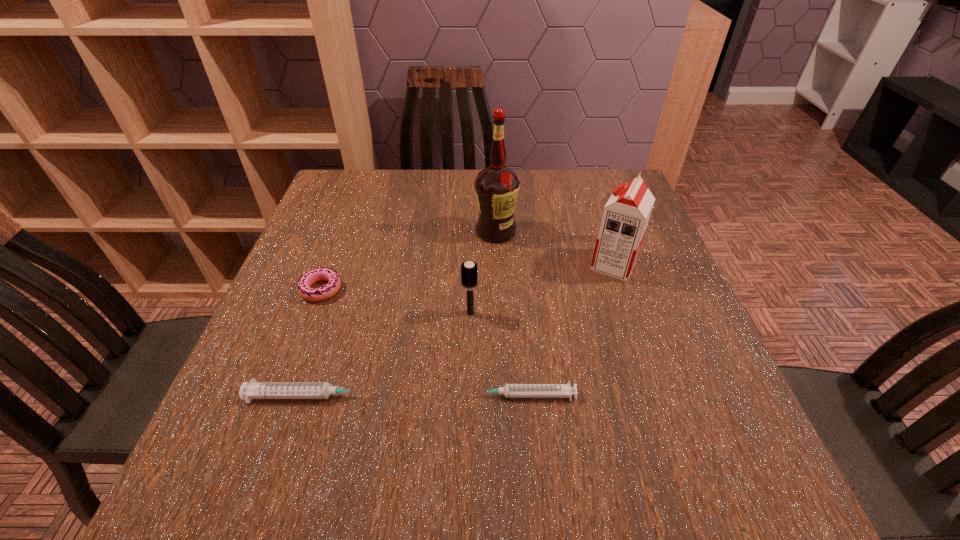
Please point a free position for a syringe on the right. Please provide its 2D coordinates. Your answer should be formatted as a tuple, i.e. [(x, y)], where the tuple contains the x and y coordinates of a point satisfying the conditions above.

[(733, 395)]